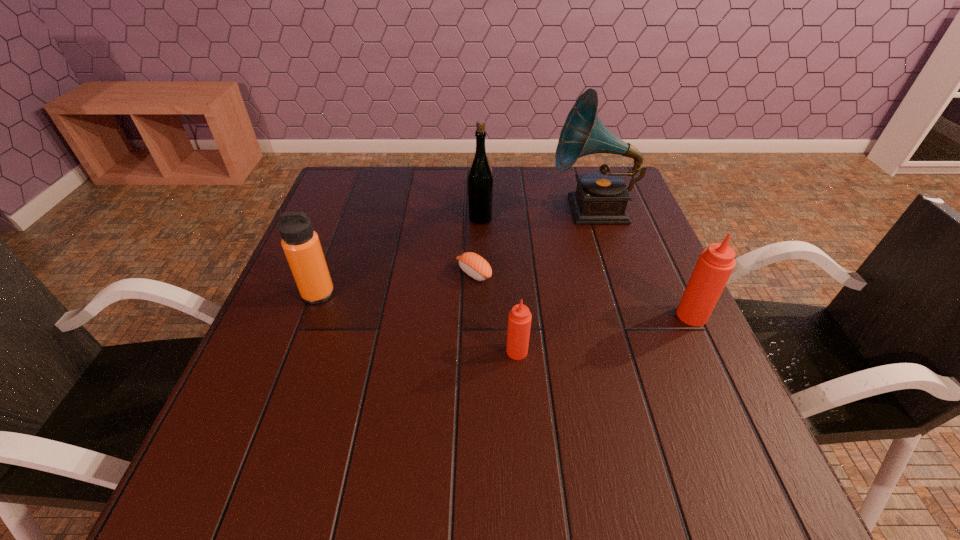
Locate an element on the screen. free space located 0.330m on the left of the second tallest object is located at coordinates (350, 218).

What are the coordinates of `vacant space located 0.170m from the horn of the phonograph_record` in the screenshot? It's located at (491, 209).

Where is `free location located 0.210m from the horn of the phonograph_record`? This screenshot has width=960, height=540. free location located 0.210m from the horn of the phonograph_record is located at coordinates (477, 209).

What are the coordinates of `vacant region located 0.060m from the horn of the phonograph_record` in the screenshot? It's located at (529, 209).

Locate an element on the screen. free space located on the back of the leftmost object is located at coordinates (334, 253).

At what (x,y) coordinates should I click in order to perform the action: click on free location located 0.340m on the left of the sushi. Please return your answer as a coordinate pair (x, y). The image size is (960, 540). Looking at the image, I should click on (315, 273).

Locate an element on the screen. object that is positioned at the far edge is located at coordinates (601, 197).

I want to click on object at the left edge, so click(x=301, y=244).

The height and width of the screenshot is (540, 960). I want to click on Tabasco sauce that is at the right edge, so pos(715,265).

Locate an element on the screen. The height and width of the screenshot is (540, 960). phonograph_record located in the right edge section of the desktop is located at coordinates (601, 197).